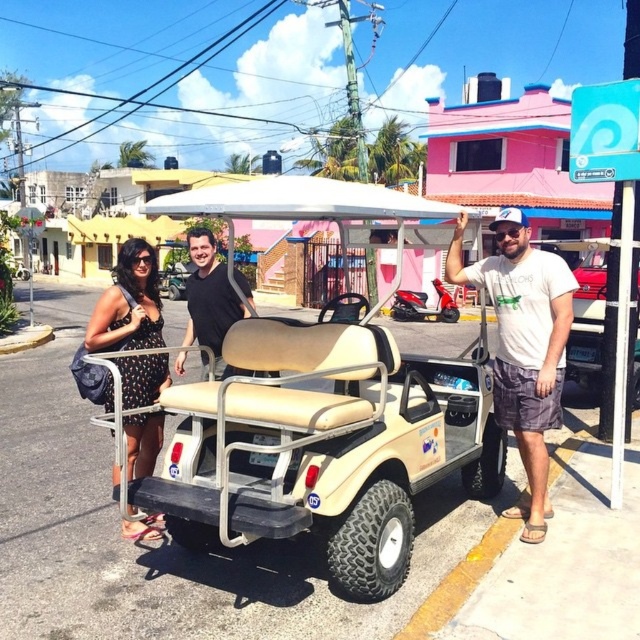
Is beige fabric golf cart at center above white cotton t-shirt at center?

No, beige fabric golf cart at center is not above white cotton t-shirt at center.

Does point (312, 529) come closer to viewer compared to point (493, 266)?

Yes.

What do you see at coordinates (324, 442) in the screenshot? I see `beige fabric golf cart at center` at bounding box center [324, 442].

This screenshot has width=640, height=640. In order to click on beige fabric golf cart at center in this screenshot , I will do `click(324, 442)`.

Between point (129, 529) and point (224, 320), which one is positioned behind?

The point (224, 320) is more distant.

Where is `black dotted dress at left`? This screenshot has width=640, height=640. black dotted dress at left is located at coordinates (129, 304).

Is the position of beige fabric golf cart at center less distant than that of black matte shirt at center?

Yes, it is in front of black matte shirt at center.

Which is more to the left, beige fabric golf cart at center or black matte shirt at center?

black matte shirt at center is more to the left.

What do you see at coordinates (324, 442) in the screenshot?
I see `beige fabric golf cart at center` at bounding box center [324, 442].

The height and width of the screenshot is (640, 640). Find the location of `beige fabric golf cart at center`. beige fabric golf cart at center is located at coordinates click(324, 442).